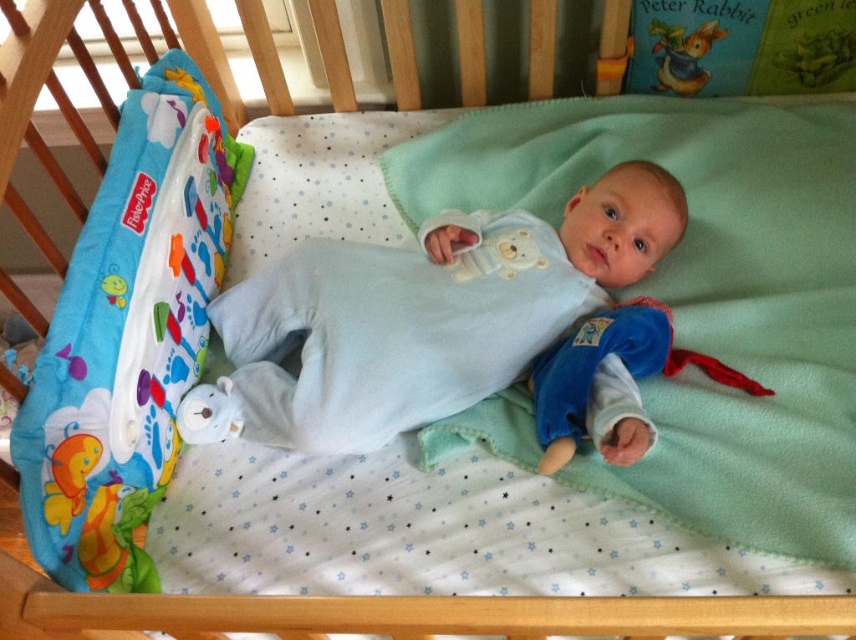
You are a parent looking at the baby in the crib. You notice two points in the scene, one at point [308,416] and another at point [627,464]. Which point is closer to you?

Point [308,416] is closer to you because it is further to the viewer than point [627,464].

You are a parent trying to cover your baby with the green fleece blanket at center. The baby is wearing the light blue fleece onesie at center. Can the blanket completely cover the onesie?

The green fleece blanket at center has a larger width than the light blue fleece onesie at center, so yes, the blanket can completely cover the onesie.